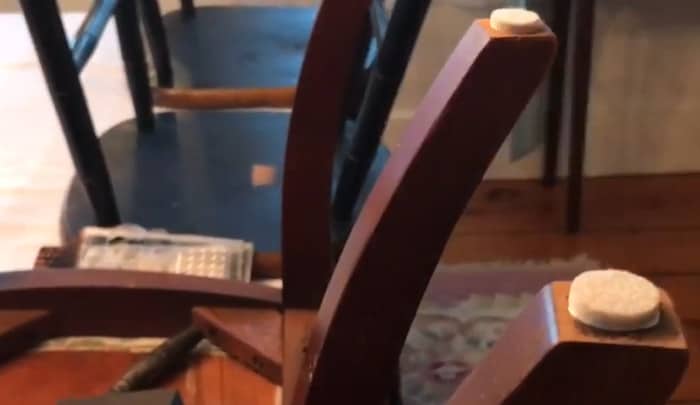
This screenshot has width=700, height=405. Identify the location of table legs. point(582,109), point(554,98).